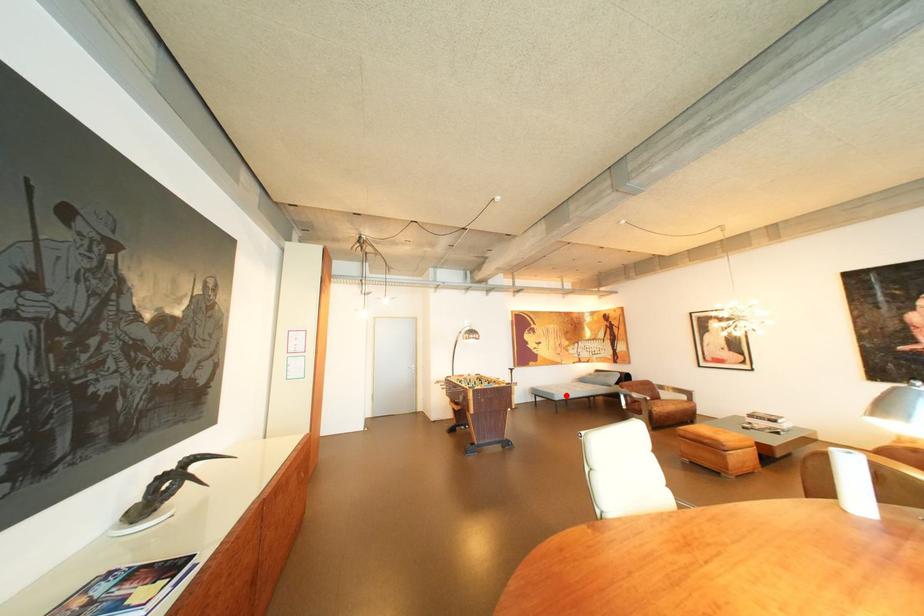
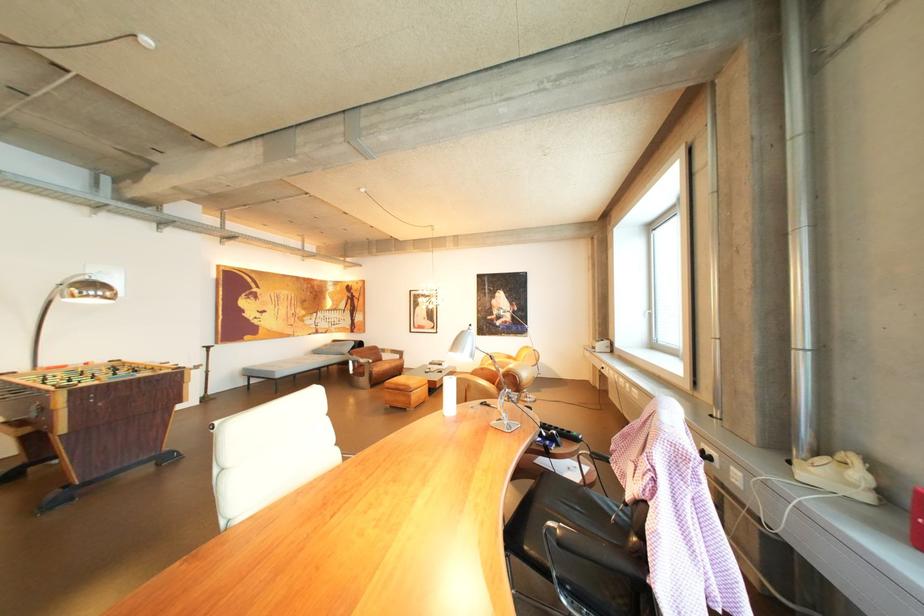
Question: A red point is marked in image1. In image2, is the corresponding 3D point closer to the camera or farther? Reply with the corresponding letter.

Choices:
 (A) The corresponding 3D point is closer.
 (B) The corresponding 3D point is farther.

Answer: (A)